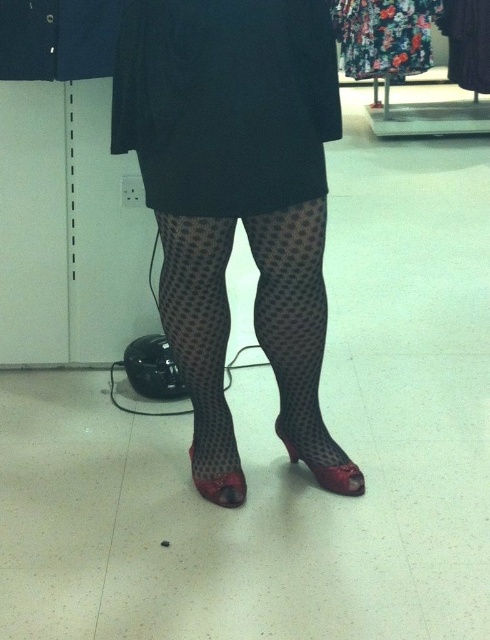
You are a fashion designer trying to create a coordinated outfit. Given the floral fabric dress at upper center and the matte black shoe at lower center, which item would you adjust to ensure they match in size appropriately?

Since the floral fabric dress at upper center is wider than the matte black shoe at lower center, you should adjust the matte black shoe at lower center to be wider to match the dress.

You are a fashion designer observing the outfit. Which item is placed lower on the body between the transparent net tights at center and the floral fabric dress at upper center?

The transparent net tights at center are positioned under the floral fabric dress at upper center, so they are lower on the body.

You are organizing a clothing store and need to arrange the transparent net tights at center and the floral fabric dress at upper center on a display rack. According to the image, which item should be placed to the left side of the rack to match their positions in the image?

The transparent net tights at center should be placed to the left side of the rack because in the image, the transparent net tights at center are to the left of the floral fabric dress at upper center.